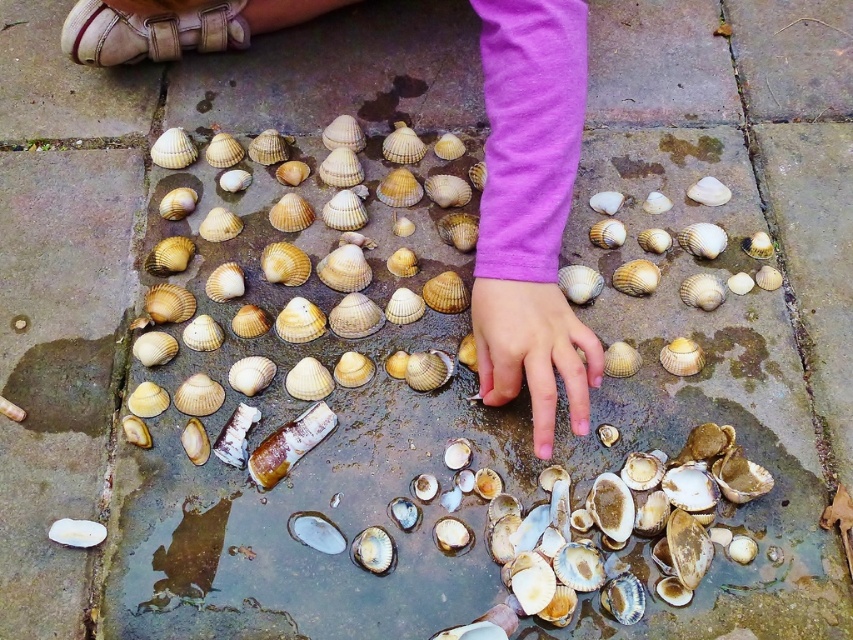
You are a photographer trying to capture a closeup of the white matte shell at center. However, the smooth skin hand at center is blocking your view. Can you move the hand to the side so you can get a clear shot of the shell?

The smooth skin hand at center is in front of the white matte shell at center, so moving the hand to the side would allow the photographer to capture a clear shot of the shell without obstruction.

You are a photographer trying to capture the reflection of the smooth beige shell at center in the puddle. However, the smooth skin hand at center is blocking the view. Can you move the hand to the side to get a clear shot of the shell?

The smooth skin hand at center is in front of the smooth beige shell at center, so moving the hand to the side would allow the photographer to capture the reflection of the shell in the puddle without obstruction.

You are a child trying to pick up both the smooth beige shell at center and the white matte shell at center. Which shell should you reach for first to grab the one closer to your hand?

The smooth beige shell at center is closer to you than the white matte shell at center, so you should reach for the smooth beige shell at center first.